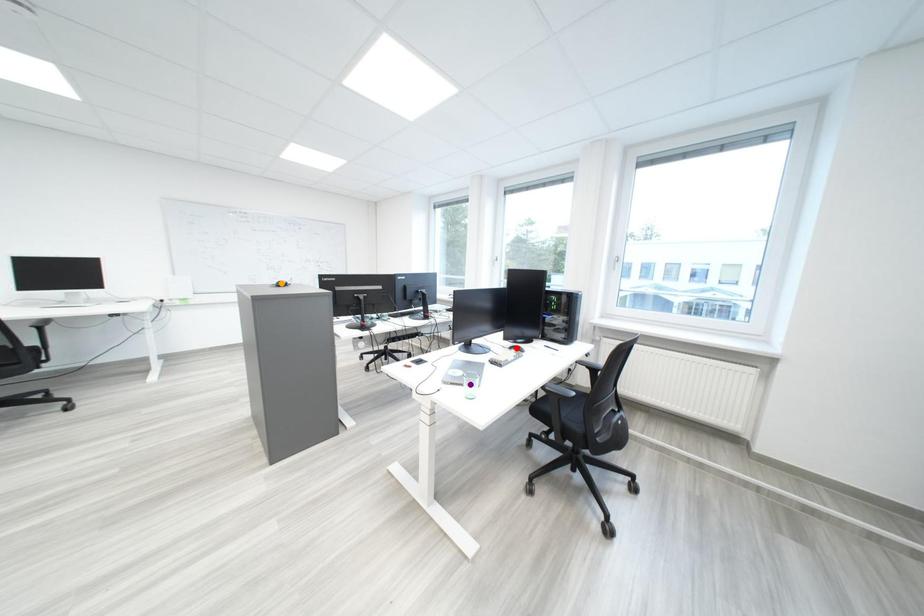
Based on the photo, order these from farthest to nearest:
- red point
- orange point
- purple point

red point
orange point
purple point